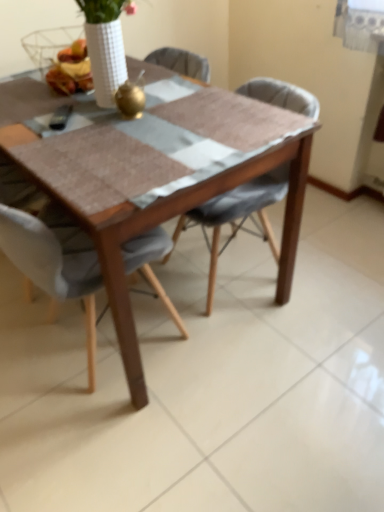
You are a GUI agent. You are given a task and a screenshot of the screen. Output one action in this format:
    pyautogui.click(x=<x>, y=<y>)
    Task: Click on the textured gray chair at center, the second chair from the left
    
    Given the screenshot: What is the action you would take?
    pyautogui.click(x=237, y=216)

Locate an element on the screen. light gray fabric chair at center, which appears as the second chair when viewed from the right is located at coordinates (53, 268).

Identify the location of matte yellow cheese at upper center. (71, 69).

Considering the positions of objects wooden table at center and textured gray chair at center, the second chair from the left, in the image provided, who is more to the left, wooden table at center or textured gray chair at center, the second chair from the left,?

Positioned to the left is wooden table at center.

Is point (188, 126) closer to viewer compared to point (273, 90)?

That is True.

In order to click on table located on the left of textured gray chair at center, the second chair from the left in this screenshot , I will do `click(154, 179)`.

From the picture: Considering the relative sizes of wooden table at center and textured gray chair at center, the 1th chair in the right-to-left sequence, in the image provided, is wooden table at center wider than textured gray chair at center, the 1th chair in the right-to-left sequence,?

Indeed, wooden table at center has a greater width compared to textured gray chair at center, the 1th chair in the right-to-left sequence.

Between light gray fabric chair at center, placed as the first chair when sorted from left to right, and textured gray chair at center, the second chair from the left, which one has larger width?

Wider between the two is textured gray chair at center, the second chair from the left.

Is point (59, 287) positioned behind point (266, 175)?

No, it is in front of (266, 175).

Can you confirm if light gray fabric chair at center, placed as the first chair when sorted from left to right, is positioned to the right of textured gray chair at center, the 1th chair in the right-to-left sequence?

No, light gray fabric chair at center, placed as the first chair when sorted from left to right, is not to the right of textured gray chair at center, the 1th chair in the right-to-left sequence.

Is light gray fabric chair at center, placed as the first chair when sorted from left to right, in front of or behind textured gray chair at center, the 1th chair in the right-to-left sequence, in the image?

In the image, light gray fabric chair at center, placed as the first chair when sorted from left to right, appears in front of textured gray chair at center, the 1th chair in the right-to-left sequence.

From the matte yellow cheese at upper center, count 1st chairs forward and point to it. Please provide its 2D coordinates.

[(237, 216)]

Is textured gray chair at center, the 1th chair in the right-to-left sequence, not within matte yellow cheese at upper center?

Yes.

Can you see textured gray chair at center, the 1th chair in the right-to-left sequence, touching matte yellow cheese at upper center?

textured gray chair at center, the 1th chair in the right-to-left sequence, and matte yellow cheese at upper center are clearly separated.

In terms of height, does textured gray chair at center, the second chair from the left, look taller or shorter compared to matte yellow cheese at upper center?

Considering their sizes, textured gray chair at center, the second chair from the left, has more height than matte yellow cheese at upper center.

Is textured gray chair at center, the 1th chair in the right-to-left sequence, in front of or behind wooden table at center in the image?

textured gray chair at center, the 1th chair in the right-to-left sequence, is behind wooden table at center.

Between textured gray chair at center, the 1th chair in the right-to-left sequence, and wooden table at center, which one has larger size?

wooden table at center is bigger.

Between textured gray chair at center, the 1th chair in the right-to-left sequence, and wooden table at center, which one has more height?

Standing taller between the two is wooden table at center.

From the image's perspective, which is below, textured gray chair at center, the 1th chair in the right-to-left sequence, or wooden table at center?

From the image's view, wooden table at center is below.

Is textured gray chair at center, the second chair from the left, not inside light gray fabric chair at center, placed as the first chair when sorted from left to right?

Yes, textured gray chair at center, the second chair from the left, is located beyond the bounds of light gray fabric chair at center, placed as the first chair when sorted from left to right.

Is point (215, 215) farther from camera compared to point (33, 255)?

Yes, it is behind point (33, 255).

Is textured gray chair at center, the second chair from the left, looking in the opposite direction of light gray fabric chair at center, placed as the first chair when sorted from left to right?

No, light gray fabric chair at center, placed as the first chair when sorted from left to right, is not at the back of textured gray chair at center, the second chair from the left.

Can you tell me how much textured gray chair at center, the 1th chair in the right-to-left sequence, and light gray fabric chair at center, placed as the first chair when sorted from left to right, differ in facing direction?

The angular difference between textured gray chair at center, the 1th chair in the right-to-left sequence, and light gray fabric chair at center, placed as the first chair when sorted from left to right, is 180 degrees.

From a real-world perspective, is light gray fabric chair at center, which appears as the second chair when viewed from the right, physically located above or below matte yellow cheese at upper center?

In terms of real-world spatial position, light gray fabric chair at center, which appears as the second chair when viewed from the right, is below matte yellow cheese at upper center.

Which object is thinner, light gray fabric chair at center, placed as the first chair when sorted from left to right, or matte yellow cheese at upper center?

matte yellow cheese at upper center is thinner.

From the image's perspective, which one is positioned lower, light gray fabric chair at center, placed as the first chair when sorted from left to right, or matte yellow cheese at upper center?

light gray fabric chair at center, placed as the first chair when sorted from left to right, appears lower in the image.

Which is correct: wooden table at center is inside light gray fabric chair at center, which appears as the second chair when viewed from the right, or outside of it?

wooden table at center cannot be found inside light gray fabric chair at center, which appears as the second chair when viewed from the right.

Considering the positions of point (149, 205) and point (27, 266), is point (149, 205) closer or farther from the camera than point (27, 266)?

Clearly, point (149, 205) is closer to the camera than point (27, 266).

From a real-world perspective, is wooden table at center located higher than light gray fabric chair at center, placed as the first chair when sorted from left to right?

No, from a real-world perspective, wooden table at center is not on top of light gray fabric chair at center, placed as the first chair when sorted from left to right.

Identify the location of chair that is behind the wooden table at center. The width and height of the screenshot is (384, 512). (237, 216).

Locate an element on the screen. The height and width of the screenshot is (512, 384). chair directly beneath the light gray fabric chair at center, which appears as the second chair when viewed from the right (from a real-world perspective) is located at coordinates (237, 216).

Which object lies nearer to the anchor point wooden table at center, textured gray chair at center, the 1th chair in the right-to-left sequence, or light gray fabric chair at center, placed as the first chair when sorted from left to right?

The object closer to wooden table at center is light gray fabric chair at center, placed as the first chair when sorted from left to right.

When comparing their distances from light gray fabric chair at center, placed as the first chair when sorted from left to right, does textured gray chair at center, the second chair from the left, or matte yellow cheese at upper center seem further?

Based on the image, matte yellow cheese at upper center appears to be further to light gray fabric chair at center, placed as the first chair when sorted from left to right.

Considering their positions, is light gray fabric chair at center, placed as the first chair when sorted from left to right, positioned further to wooden table at center than matte yellow cheese at upper center?

Among the two, matte yellow cheese at upper center is located further to wooden table at center.

Based on their spatial positions, is matte yellow cheese at upper center or textured gray chair at center, the 1th chair in the right-to-left sequence, further from light gray fabric chair at center, placed as the first chair when sorted from left to right?

matte yellow cheese at upper center lies further to light gray fabric chair at center, placed as the first chair when sorted from left to right, than the other object.

Considering their positions, is textured gray chair at center, the second chair from the left, positioned closer to matte yellow cheese at upper center than light gray fabric chair at center, which appears as the second chair when viewed from the right?

Among the two, light gray fabric chair at center, which appears as the second chair when viewed from the right, is located nearer to matte yellow cheese at upper center.

Looking at the image, which one is located further to textured gray chair at center, the 1th chair in the right-to-left sequence, wooden table at center or light gray fabric chair at center, which appears as the second chair when viewed from the right?

light gray fabric chair at center, which appears as the second chair when viewed from the right, is positioned further to the anchor textured gray chair at center, the 1th chair in the right-to-left sequence.

Considering their positions, is matte yellow cheese at upper center positioned closer to textured gray chair at center, the second chair from the left, than light gray fabric chair at center, placed as the first chair when sorted from left to right?

The object closer to textured gray chair at center, the second chair from the left, is light gray fabric chair at center, placed as the first chair when sorted from left to right.

Based on their spatial positions, is textured gray chair at center, the 1th chair in the right-to-left sequence, or matte yellow cheese at upper center further from wooden table at center?

The object further to wooden table at center is matte yellow cheese at upper center.

Identify the location of table between matte yellow cheese at upper center and light gray fabric chair at center, placed as the first chair when sorted from left to right, in the up-down direction. (154, 179).

I want to click on table between matte yellow cheese at upper center and textured gray chair at center, the 1th chair in the right-to-left sequence, so click(x=154, y=179).

At what (x,y) coordinates should I click in order to perform the action: click on table located between light gray fabric chair at center, placed as the first chair when sorted from left to right, and textured gray chair at center, the 1th chair in the right-to-left sequence, in the left-right direction. Please return your answer as a coordinate pair (x, y). This screenshot has height=512, width=384. Looking at the image, I should click on (154, 179).

This screenshot has width=384, height=512. I want to click on chair that lies between matte yellow cheese at upper center and light gray fabric chair at center, which appears as the second chair when viewed from the right, from top to bottom, so click(237, 216).